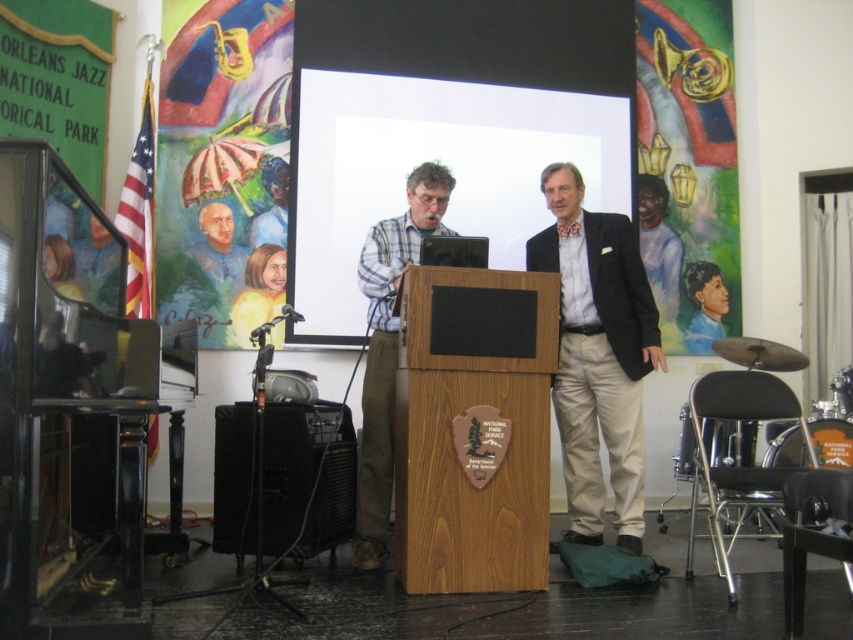
Between wooden podium at center and black plastic speaker at lower left, which one appears on the left side from the viewer's perspective?

black plastic speaker at lower left is more to the left.

Does wooden podium at center appear on the right side of black plastic speaker at lower left?

Yes, wooden podium at center is to the right of black plastic speaker at lower left.

Image resolution: width=853 pixels, height=640 pixels. I want to click on wooden podium at center, so click(x=473, y=428).

This screenshot has width=853, height=640. What are the coordinates of `wooden podium at center` in the screenshot? It's located at (473, 428).

Does wooden podium at center come in front of matte black projector at center?

Yes.

Does wooden podium at center have a greater height compared to matte black projector at center?

Correct, wooden podium at center is much taller as matte black projector at center.

This screenshot has height=640, width=853. I want to click on wooden podium at center, so click(x=473, y=428).

Who is lower down, light beige cotton pants at center or plaid shirt at center?

plaid shirt at center is lower down.

Between point (573, 536) and point (408, 257), which one is positioned behind?

The point (573, 536) is more distant.

What do you see at coordinates (596, 355) in the screenshot? I see `light beige cotton pants at center` at bounding box center [596, 355].

At what (x,y) coordinates should I click in order to perform the action: click on light beige cotton pants at center. Please return your answer as a coordinate pair (x, y). Looking at the image, I should click on (596, 355).